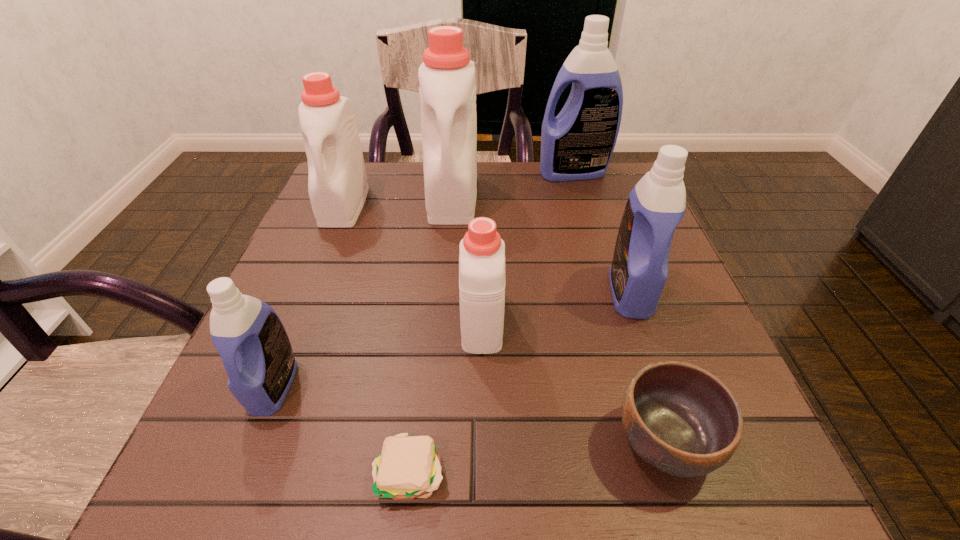
Find the location of a particular element. patty that is at the near edge is located at coordinates (408, 467).

Locate an element on the screen. This screenshot has width=960, height=540. bowl that is at the right edge is located at coordinates (680, 419).

Image resolution: width=960 pixels, height=540 pixels. What are the coordinates of `object that is at the far left corner` in the screenshot? It's located at (337, 180).

What are the coordinates of `object that is at the far right corner` in the screenshot? It's located at (577, 144).

This screenshot has height=540, width=960. What are the coordinates of `object present at the near right corner` in the screenshot? It's located at (680, 419).

The height and width of the screenshot is (540, 960). In order to click on vacant space at the far edge of the desktop in this screenshot , I will do `click(575, 199)`.

You are a GUI agent. You are given a task and a screenshot of the screen. Output one action in this format:
    pyautogui.click(x=<x>, y=<y>)
    Task: Click on the vacant area at the near edge
    
    Given the screenshot: What is the action you would take?
    pyautogui.click(x=459, y=444)

The width and height of the screenshot is (960, 540). In order to click on vacant space at the left edge of the desktop in this screenshot , I will do `click(300, 350)`.

Locate an element on the screen. vacant space at the right edge of the desktop is located at coordinates (738, 396).

This screenshot has width=960, height=540. Identify the location of vacant point at the far left corner. (366, 208).